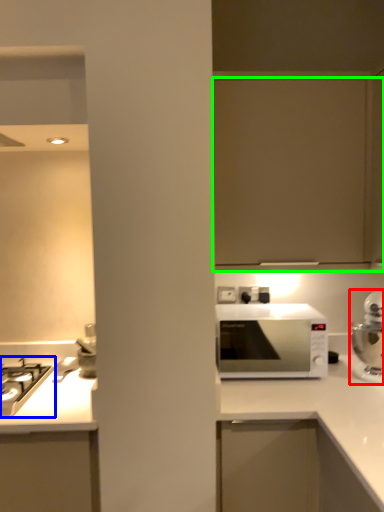
Question: Considering the real-world distances, which object is farthest from home appliance (highlighted by a red box)? gas stove (highlighted by a blue box) or cabinetry (highlighted by a green box)?

Choices:
 (A) gas stove
 (B) cabinetry

Answer: (A)